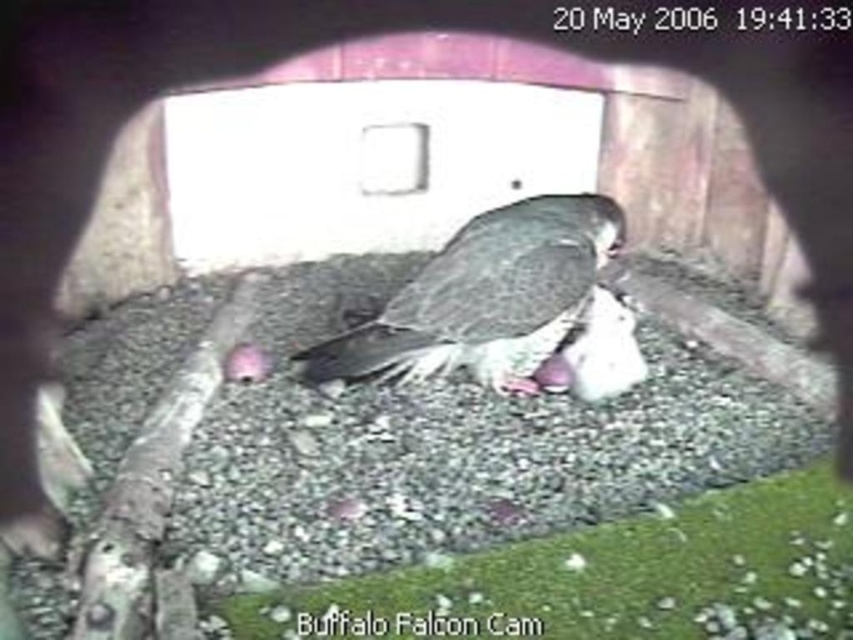
You are analyzing a falcon cam image from 2006. There are two points marked on the image, point 1 at coordinates (x=236, y=385) and point 2 at (x=480, y=317). Based on the camera perspective, which point is closer to the camera?

Point 2 at (x=480, y=317) is closer to the camera because the description states that point 1 is behind point 2.

Based on the scene from the Buffalo Falcon Cam on 20 May 2006, there is gray gravel at center and dark gray feathers at center. Which object is positioned higher in the image?

The gray gravel at center is much taller than dark gray feathers at center, so the gray gravel at center is positioned higher in the image.

Based on the scene from the Buffalo Falcon Cam on 20 May 2006, there is a gray gravel at center and dark gray feathers at center. Which object is positioned lower in the image?

The gray gravel at center is positioned below the dark gray feathers at center, so the gray gravel at center is lower in the image.